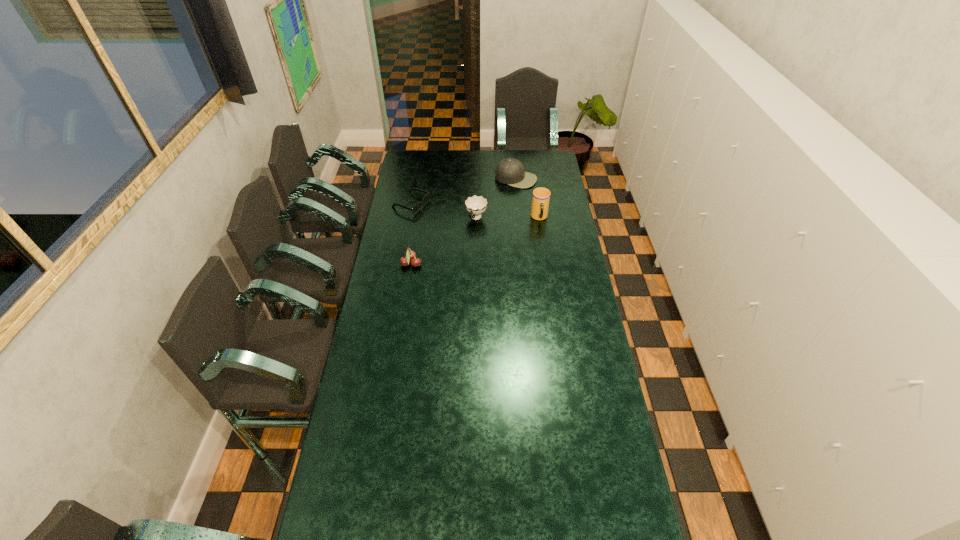
Where is `free location located 0.300m on the brim of the farthest object`? This screenshot has width=960, height=540. free location located 0.300m on the brim of the farthest object is located at coordinates (487, 219).

Locate an element on the screen. This screenshot has width=960, height=540. free space located 0.110m on the brim of the farthest object is located at coordinates (501, 199).

Where is `free space located 0.190m on the side of the third object from left to right with the handle`? free space located 0.190m on the side of the third object from left to right with the handle is located at coordinates (458, 251).

The width and height of the screenshot is (960, 540). I want to click on vacant space located on the side of the third object from left to right with the handle, so click(442, 279).

Locate an element on the screen. This screenshot has width=960, height=540. vacant space located 0.120m on the side of the third object from left to right with the handle is located at coordinates (464, 241).

The height and width of the screenshot is (540, 960). What are the coordinates of `vacant space located 0.130m on the front-facing side of the shortest object` in the screenshot? It's located at (448, 218).

The image size is (960, 540). In order to click on vacant space situated 0.370m on the front-facing side of the shortest object in this screenshot , I will do `click(490, 233)`.

The width and height of the screenshot is (960, 540). I want to click on free space located on the front-facing side of the shortest object, so click(482, 231).

I want to click on object located in the far edge section of the desktop, so click(511, 171).

This screenshot has height=540, width=960. Identify the location of cherry located at the left edge. (410, 255).